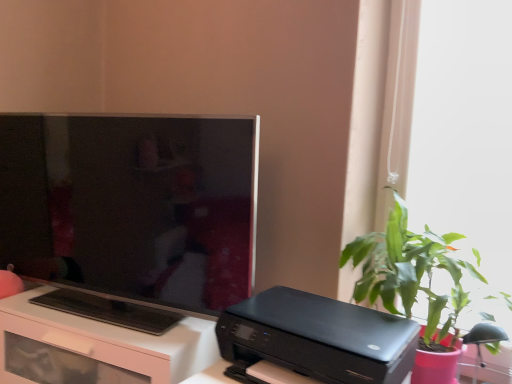
Question: Is matte black tv at left oriented away from white glossy desk at lower left?

Choices:
 (A) no
 (B) yes

Answer: (A)

Question: Does matte black tv at left come behind white glossy desk at lower left?

Choices:
 (A) yes
 (B) no

Answer: (B)

Question: From the image's perspective, is matte black tv at left located above white glossy desk at lower left?

Choices:
 (A) yes
 (B) no

Answer: (A)

Question: From a real-world perspective, is matte black tv at left located higher than white glossy desk at lower left?

Choices:
 (A) no
 (B) yes

Answer: (B)

Question: Does matte black tv at left turn towards white glossy desk at lower left?

Choices:
 (A) no
 (B) yes

Answer: (A)

Question: From the image's perspective, relative to green leafy plant at right, is black glossy printer at lower center above or below?

Choices:
 (A) above
 (B) below

Answer: (B)

Question: Is black glossy printer at lower center bigger or smaller than green leafy plant at right?

Choices:
 (A) small
 (B) big

Answer: (A)

Question: Is point (272, 309) closer or farther from the camera than point (438, 307)?

Choices:
 (A) farther
 (B) closer

Answer: (B)

Question: Considering the positions of black glossy printer at lower center and green leafy plant at right in the image, is black glossy printer at lower center wider or thinner than green leafy plant at right?

Choices:
 (A) thin
 (B) wide

Answer: (B)

Question: Is white glossy desk at lower left inside the boundaries of matte black tv at left, or outside?

Choices:
 (A) outside
 (B) inside

Answer: (A)

Question: Is white glossy desk at lower left in front of or behind matte black tv at left in the image?

Choices:
 (A) behind
 (B) front

Answer: (A)

Question: From a real-world perspective, is white glossy desk at lower left positioned above or below matte black tv at left?

Choices:
 (A) above
 (B) below

Answer: (B)

Question: Considering the positions of white glossy desk at lower left and matte black tv at left in the image, is white glossy desk at lower left taller or shorter than matte black tv at left?

Choices:
 (A) tall
 (B) short

Answer: (B)

Question: Is black glossy printer at lower center in front of or behind white glossy desk at lower left in the image?

Choices:
 (A) front
 (B) behind

Answer: (A)

Question: Is black glossy printer at lower center spatially inside white glossy desk at lower left, or outside of it?

Choices:
 (A) inside
 (B) outside

Answer: (B)